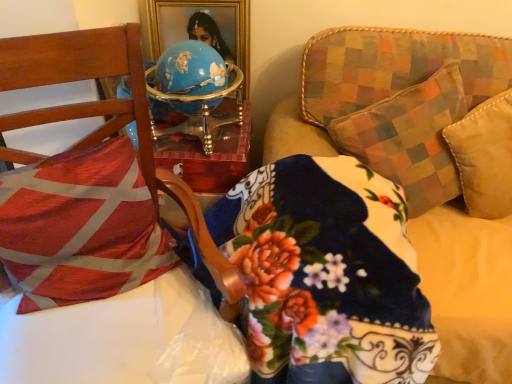
This screenshot has width=512, height=384. What do you see at coordinates (96, 239) in the screenshot?
I see `wooden chair at left` at bounding box center [96, 239].

In order to face wooden chair at left, should I rotate leftwards or rightwards?

To align with it, rotate left about 21.906°.

Measure the distance between point (501,303) and camera.

Point (501,303) and camera are 1.12 meters apart.

What are the coordinates of `red and white fabric pillow at left` in the screenshot? It's located at point(81,227).

From the image's perspective, between wooden chair at left and fluffy fabric couch at upper right, which one is located above?

fluffy fabric couch at upper right.

Consider the image. Can you see wooden chair at left touching fluffy fabric couch at upper right?

No, wooden chair at left is not in contact with fluffy fabric couch at upper right.

In the scene shown: Which is more to the left, wooden chair at left or fluffy fabric couch at upper right?

From the viewer's perspective, wooden chair at left appears more on the left side.

Considering the relative positions of wooden chair at left and fluffy fabric couch at upper right in the image provided, is wooden chair at left behind fluffy fabric couch at upper right?

No, the depth of wooden chair at left is less than that of fluffy fabric couch at upper right.

Which of these two, red and white fabric pillow at left or fluffy fabric couch at upper right, is bigger?

fluffy fabric couch at upper right is bigger.

Are red and white fabric pillow at left and fluffy fabric couch at upper right located far from each other?

red and white fabric pillow at left is near fluffy fabric couch at upper right, not far away.

Consider the image. How many degrees apart are the facing directions of red and white fabric pillow at left and fluffy fabric couch at upper right?

The facing directions of red and white fabric pillow at left and fluffy fabric couch at upper right are 21.4 degrees apart.

From the image's perspective, between red and white fabric pillow at left and fluffy fabric couch at upper right, who is located below?

fluffy fabric couch at upper right, from the image's perspective.

From a real-world perspective, is wooden chair at left physically located above or below red and white fabric pillow at left?

Clearly, from a real-world perspective, wooden chair at left is below red and white fabric pillow at left.

Can you confirm if wooden chair at left is wider than red and white fabric pillow at left?

Yes, wooden chair at left is wider than red and white fabric pillow at left.

In terms of size, does wooden chair at left appear bigger or smaller than red and white fabric pillow at left?

In the image, wooden chair at left appears to be larger than red and white fabric pillow at left.

In the image, is wooden chair at left on the left side or the right side of red and white fabric pillow at left?

Based on their positions, wooden chair at left is located to the right of red and white fabric pillow at left.

Would you say fluffy fabric couch at upper right is to the left or to the right of red and white fabric pillow at left in the picture?

From the image, it's evident that fluffy fabric couch at upper right is to the right of red and white fabric pillow at left.

From a real-world perspective, is fluffy fabric couch at upper right below red and white fabric pillow at left?

Yes.

Between fluffy fabric couch at upper right and red and white fabric pillow at left, which one is positioned in front?

fluffy fabric couch at upper right is in front.

Is fluffy fabric couch at upper right wider than red and white fabric pillow at left?

Indeed, fluffy fabric couch at upper right has a greater width compared to red and white fabric pillow at left.

Considering the relative positions of fluffy fabric couch at upper right and wooden chair at left in the image provided, is fluffy fabric couch at upper right to the left of wooden chair at left from the viewer's perspective?

No, fluffy fabric couch at upper right is not to the left of wooden chair at left.

Considering the relative sizes of fluffy fabric couch at upper right and wooden chair at left in the image provided, is fluffy fabric couch at upper right thinner than wooden chair at left?

No.

How many degrees apart are the facing directions of fluffy fabric couch at upper right and wooden chair at left?

The angle between the facing direction of fluffy fabric couch at upper right and the facing direction of wooden chair at left is 27.4 degrees.

Does fluffy fabric couch at upper right come behind wooden chair at left?

That is True.

Is wooden chair at left surrounded by red and white fabric pillow at left?

No, wooden chair at left is not inside red and white fabric pillow at left.

Which object is positioned more to the left, red and white fabric pillow at left or wooden chair at left?

Positioned to the left is red and white fabric pillow at left.

Can you confirm if red and white fabric pillow at left is taller than wooden chair at left?

In fact, red and white fabric pillow at left may be shorter than wooden chair at left.

Which object is closer to the camera, red and white fabric pillow at left or wooden chair at left?

wooden chair at left.

You are a GUI agent. You are given a task and a screenshot of the screen. Output one action in this format:
    pyautogui.click(x=<x>, y=<y>)
    Task: Click on the furniture that is in front of the fluffy fabric couch at upper right
    The image size is (512, 384).
    Given the screenshot: What is the action you would take?
    pyautogui.click(x=96, y=239)

Find the location of `studio couch located on the right of red and white fabric pillow at left`. studio couch located on the right of red and white fabric pillow at left is located at coordinates (391, 102).

When comparing their distances from fluffy fabric couch at upper right, does wooden chair at left or red and white fabric pillow at left seem closer?

Based on the image, wooden chair at left appears to be nearer to fluffy fabric couch at upper right.

Based on their spatial positions, is fluffy fabric couch at upper right or red and white fabric pillow at left closer to wooden chair at left?

red and white fabric pillow at left is positioned closer to the anchor wooden chair at left.

From the image, which object appears to be farther from red and white fabric pillow at left, fluffy fabric couch at upper right or wooden chair at left?

The object further to red and white fabric pillow at left is fluffy fabric couch at upper right.

From the image, which object appears to be farther from red and white fabric pillow at left, wooden chair at left or fluffy fabric couch at upper right?

fluffy fabric couch at upper right is positioned further to the anchor red and white fabric pillow at left.

When comparing their distances from wooden chair at left, does red and white fabric pillow at left or fluffy fabric couch at upper right seem closer?

red and white fabric pillow at left is closer to wooden chair at left.

In the scene shown: Which object lies further to the anchor point fluffy fabric couch at upper right, red and white fabric pillow at left or wooden chair at left?

red and white fabric pillow at left.

The width and height of the screenshot is (512, 384). What are the coordinates of `furniture between red and white fabric pillow at left and fluffy fabric couch at upper right in the horizontal direction` in the screenshot? It's located at pos(96,239).